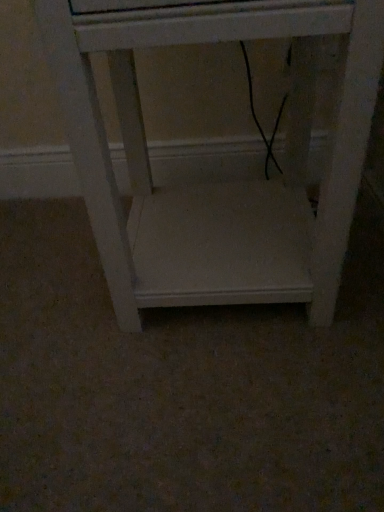
Image resolution: width=384 pixels, height=512 pixels. I want to click on free space to the left of white matte shelf at center, so click(x=54, y=288).